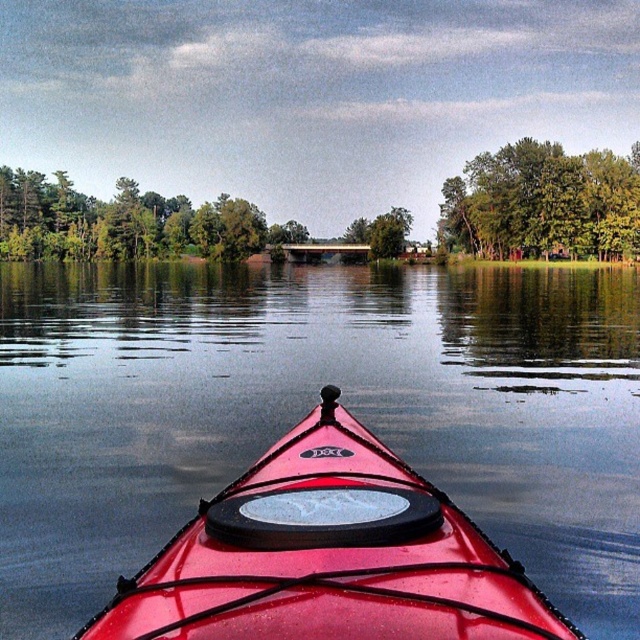
Can you confirm if green leafy tree at upper center is thinner than green matte tree at center?

No, green leafy tree at upper center is not thinner than green matte tree at center.

The image size is (640, 640). I want to click on green leafy tree at upper center, so click(x=544, y=204).

Is point (509, 257) positioned behind point (390, 225)?

No.

The image size is (640, 640). Find the location of `green leafy tree at upper center`. green leafy tree at upper center is located at coordinates (544, 204).

Is shiny red kayak at center positioned at the back of green matte tree at center?

No, it is not.

What do you see at coordinates (330, 556) in the screenshot?
I see `shiny red kayak at center` at bounding box center [330, 556].

This screenshot has width=640, height=640. What are the coordinates of `shiny red kayak at center` in the screenshot? It's located at (330, 556).

Where is `shiny red kayak at center`? shiny red kayak at center is located at coordinates (330, 556).

Who is more distant from viewer, (337,563) or (449,202)?

The point (449,202) is more distant.

Does point (268, 490) lie in front of point (467, 168)?

Yes.

The height and width of the screenshot is (640, 640). What are the coordinates of `shiny red kayak at center` in the screenshot? It's located at (330, 556).